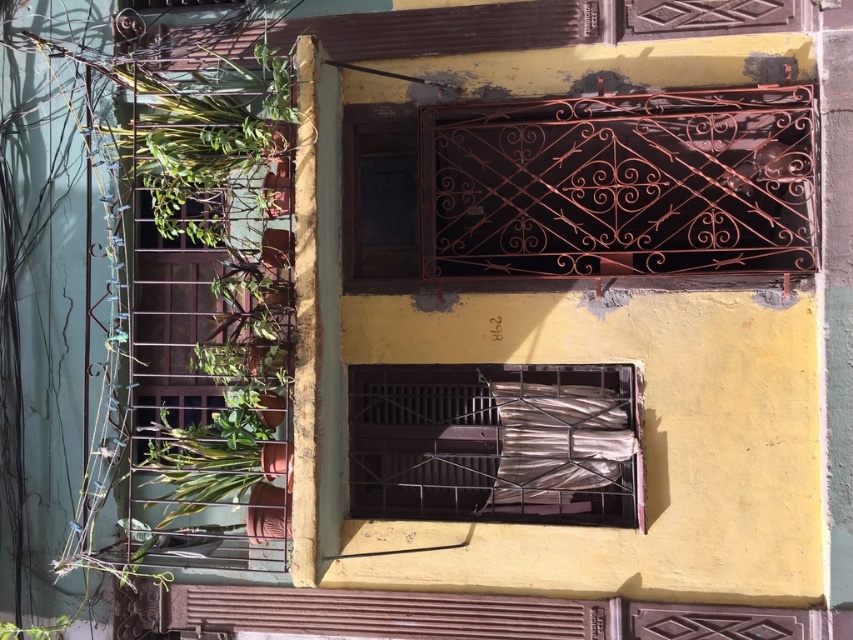
You are a painter who needs to paint both the rusty metal gate at upper center and the rusty metal shutter at lower center. You have a ladder that is 3 feet long. Can you reach both objects with this ladder without moving it?

The rusty metal gate at upper center and rusty metal shutter at lower center are 3.66 feet apart. Since the ladder is only 3 feet long, it is not long enough to cover the 3.66 feet distance between the two objects. You would need to move the ladder to reach both.

You are standing in front of the building facade shown in the image. The brown matte window at center is located at coordinates point 0.692, 0.580. If you were to move 0.1 units to the right along the x axis, would you be closer to the teal wall or the balcony?

Moving 0.1 units to the right along the x axis from the brown matte window at center would place you at point (494, 506). Since the teal wall is to the right of the window and the balcony is to the left, you would be closer to the teal wall.

Based on the photo, you are a painter trying to decide which object to paint first. You need to know which is narrower between the brown matte window at center and the rusty metal shutter at lower center. Which one is narrower?

The brown matte window at center is thinner than the rusty metal shutter at lower center, so the brown matte window at center is narrower.